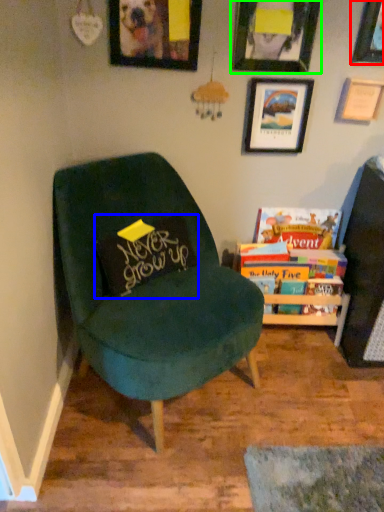
Question: Considering the real-world distances, which object is farthest from picture frame (highlighted by a red box)? pillow (highlighted by a blue box) or picture frame (highlighted by a green box)?

Choices:
 (A) pillow
 (B) picture frame

Answer: (A)